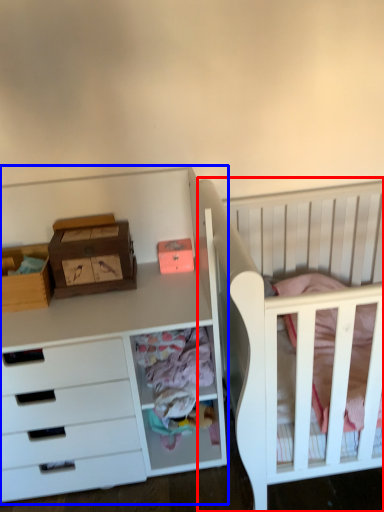
Question: Which object is closer to the camera taking this photo, infant bed (highlighted by a red box) or chest of drawers (highlighted by a blue box)?

Choices:
 (A) infant bed
 (B) chest of drawers

Answer: (A)